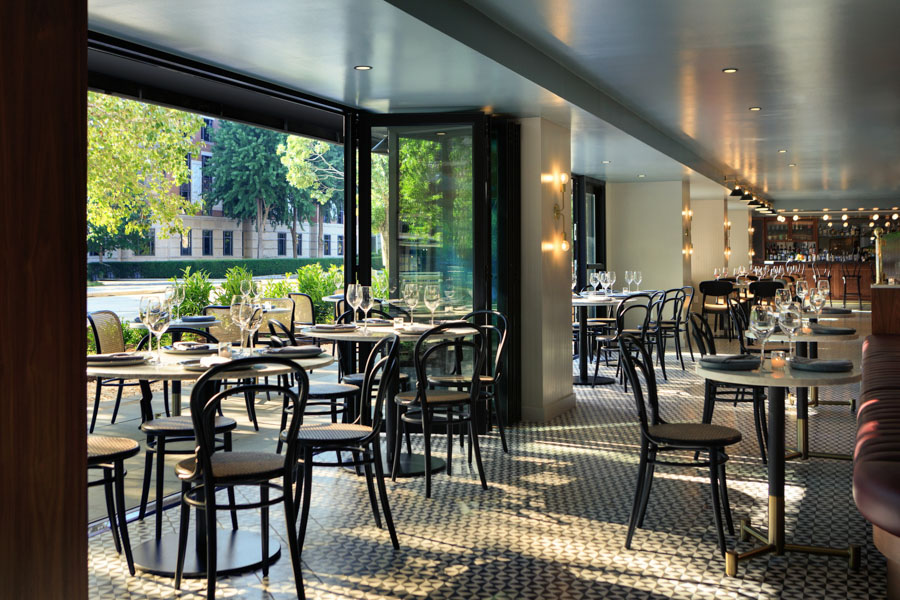
The width and height of the screenshot is (900, 600). I want to click on retractable glass wall, so click(x=428, y=227), click(x=492, y=224).